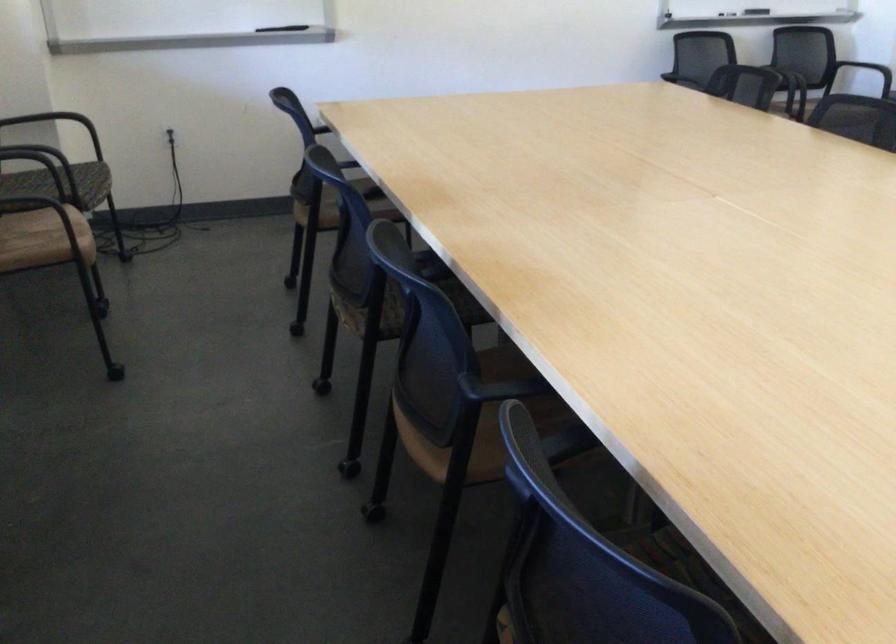
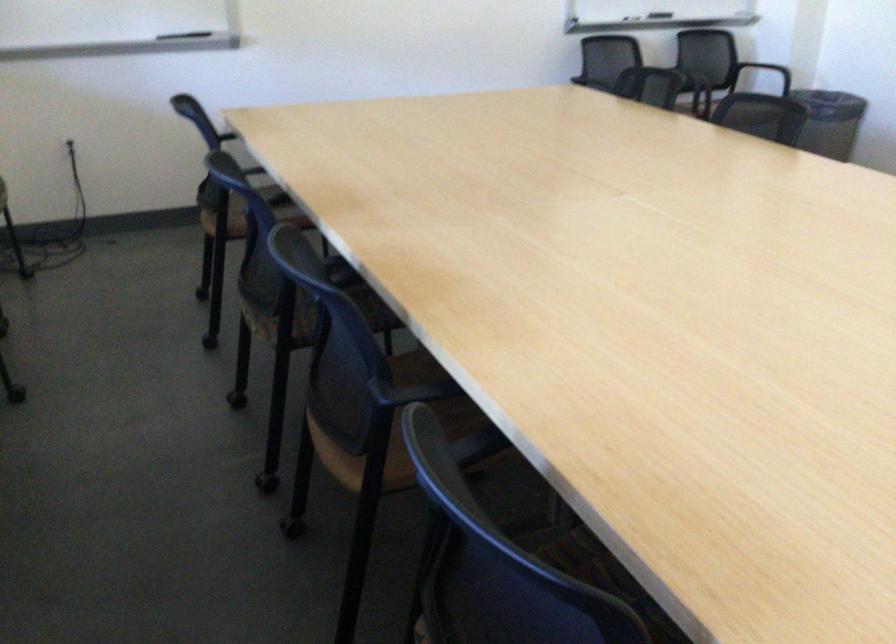
In the second image, find the point that corresponds to the point at 343,162 in the first image.

(253, 169)